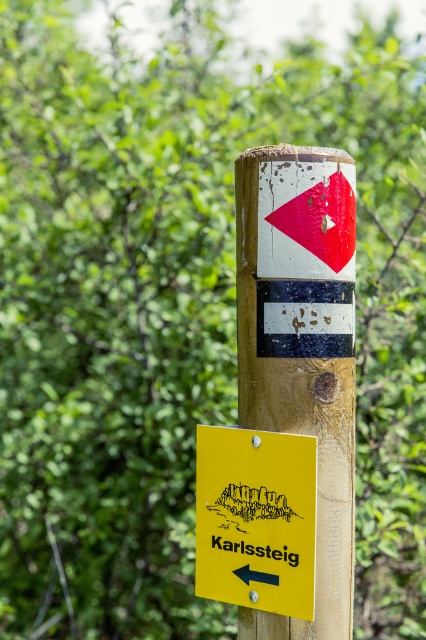
How far apart are yellow matte sign at lower left and black rubber arrow at lower left?

The distance of yellow matte sign at lower left from black rubber arrow at lower left is 3.79 inches.

The width and height of the screenshot is (426, 640). In order to click on yellow matte sign at lower left in this screenshot , I will do `click(256, 516)`.

Locate an element on the screen. This screenshot has width=426, height=640. yellow matte sign at lower left is located at coordinates (256, 516).

Does wooden signpost at center have a lesser height compared to black rubber arrow at lower left?

No, wooden signpost at center is not shorter than black rubber arrow at lower left.

In the scene shown: Is wooden signpost at center further to the viewer compared to black rubber arrow at lower left?

No, it is in front of black rubber arrow at lower left.

Between point (268, 396) and point (244, 572), which one is positioned behind?

The point (244, 572) is behind.

The image size is (426, 640). I want to click on wooden signpost at center, so click(x=299, y=362).

Can you confirm if wooden signpost at center is thinner than yellow matte sign at lower left?

Yes.

Is wooden signpost at center below yellow matte sign at lower left?

Incorrect, wooden signpost at center is not positioned below yellow matte sign at lower left.

Identify the location of wooden signpost at center. (299, 362).

Where is `wooden signpost at center`? This screenshot has height=640, width=426. wooden signpost at center is located at coordinates (299, 362).